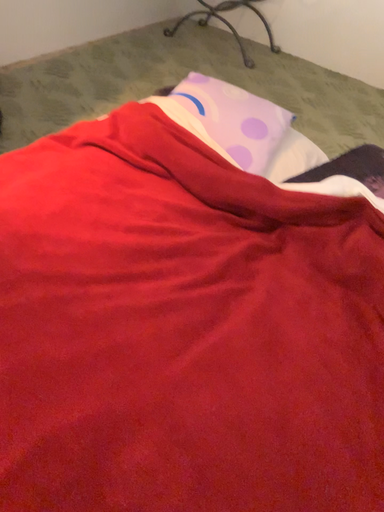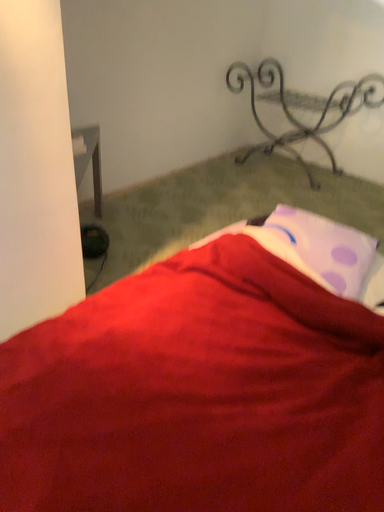
Question: Which way did the camera rotate in the video?

Choices:
 (A) rotated upward
 (B) rotated downward

Answer: (A)